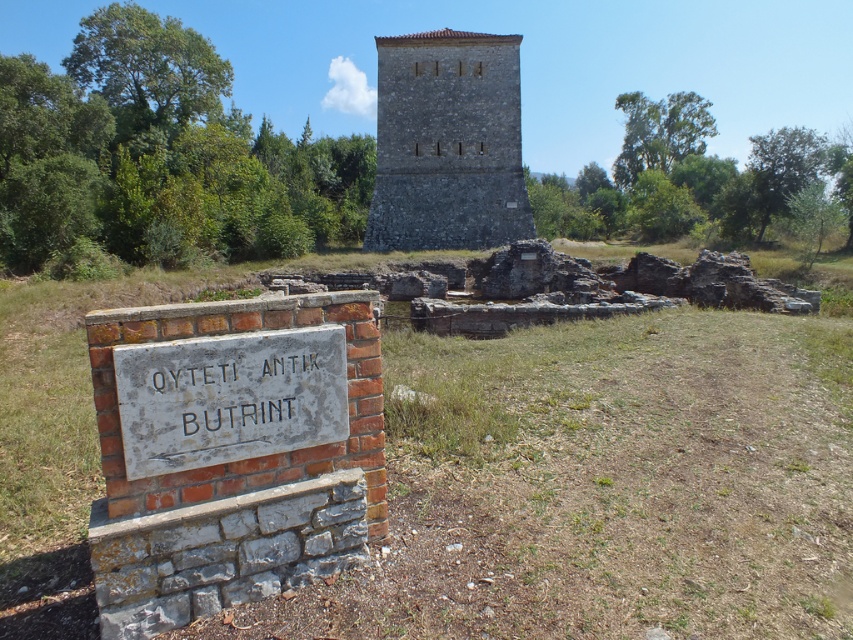
You are an archaeologist standing at the archaeological site. You need to determine which object is bigger between the stone tower at center and the white stone sign at lower left. Which one is larger?

The stone tower at center is larger than the white stone sign at lower left according to the description.

You are a tour guide leading a group to the stone tower at center. As you approach the brick sign at lower left, which object will block your path first?

The brick sign at lower left is in front of the stone tower at center, so it will block your path first as you approach the stone tower at center.